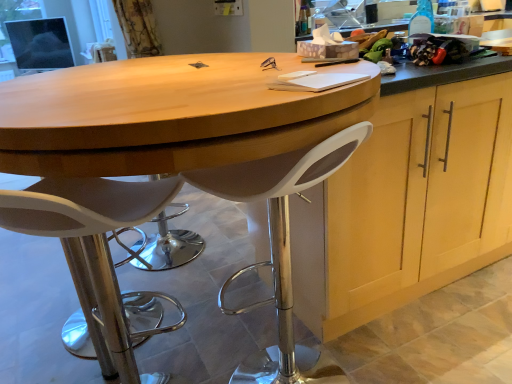
Question: Which direction should I rotate to look at white plastic stool at center, the second chair viewed from the left?

Choices:
 (A) left
 (B) right

Answer: (B)

Question: Is white plastic stool at lower left, positioned as the second chair in right-to-left order, not close to light wood cabinet at center?

Choices:
 (A) no
 (B) yes

Answer: (A)

Question: From the image's perspective, would you say white plastic stool at lower left, positioned as the 1th chair in left-to-right order, is shown under light wood cabinet at center?

Choices:
 (A) yes
 (B) no

Answer: (A)

Question: Considering the relative sizes of white plastic stool at lower left, positioned as the second chair in right-to-left order, and light wood cabinet at center in the image provided, is white plastic stool at lower left, positioned as the second chair in right-to-left order, wider than light wood cabinet at center?

Choices:
 (A) no
 (B) yes

Answer: (A)

Question: Does white plastic stool at lower left, positioned as the second chair in right-to-left order, have a larger size compared to light wood cabinet at center?

Choices:
 (A) no
 (B) yes

Answer: (A)

Question: Is white plastic stool at lower left, positioned as the 1th chair in left-to-right order, further to camera compared to light wood cabinet at center?

Choices:
 (A) no
 (B) yes

Answer: (A)

Question: Does white plastic stool at lower left, positioned as the 1th chair in left-to-right order, have a lesser height compared to light wood cabinet at center?

Choices:
 (A) no
 (B) yes

Answer: (B)

Question: From the image's perspective, is white plastic stool at lower left, positioned as the 1th chair in left-to-right order, on top of wooden table at center?

Choices:
 (A) yes
 (B) no

Answer: (B)

Question: From the image's perspective, is white plastic stool at lower left, positioned as the 1th chair in left-to-right order, located beneath wooden table at center?

Choices:
 (A) no
 (B) yes

Answer: (B)

Question: Considering the relative sizes of white plastic stool at lower left, positioned as the second chair in right-to-left order, and wooden table at center in the image provided, is white plastic stool at lower left, positioned as the second chair in right-to-left order, wider than wooden table at center?

Choices:
 (A) yes
 (B) no

Answer: (B)

Question: Can you confirm if white plastic stool at lower left, positioned as the second chair in right-to-left order, is positioned to the right of wooden table at center?

Choices:
 (A) yes
 (B) no

Answer: (B)

Question: Is white plastic stool at lower left, positioned as the 1th chair in left-to-right order, facing towards wooden table at center?

Choices:
 (A) yes
 (B) no

Answer: (A)

Question: Can you confirm if white plastic stool at lower left, positioned as the 1th chair in left-to-right order, is shorter than wooden table at center?

Choices:
 (A) no
 (B) yes

Answer: (B)

Question: Is white plastic stool at center, which is the first chair from right to left, taller than wooden table at center?

Choices:
 (A) no
 (B) yes

Answer: (A)